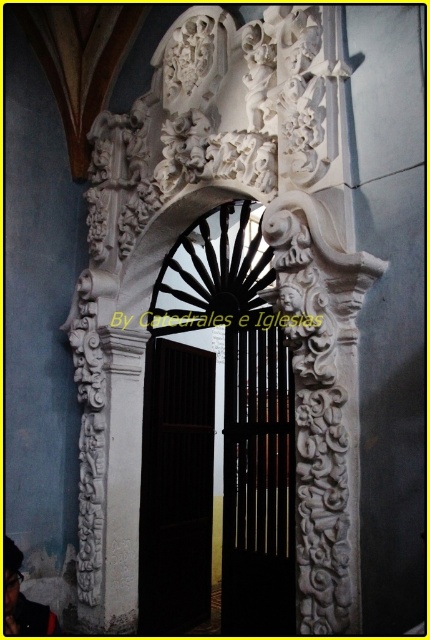
Question: Which point is closer to the camera?

Choices:
 (A) black polished wood door at center
 (B) dark wood door at center
 (C) white carved wood door at center

Answer: (A)

Question: Is white carved wood door at center above dark wood door at center?

Choices:
 (A) no
 (B) yes

Answer: (B)

Question: Does white carved wood door at center have a smaller size compared to black polished wood door at center?

Choices:
 (A) no
 (B) yes

Answer: (A)

Question: Which object is the farthest from the black polished wood door at center?

Choices:
 (A) white carved wood door at center
 (B) dark wood door at center

Answer: (B)

Question: Is white carved wood door at center to the left of dark wood door at center from the viewer's perspective?

Choices:
 (A) yes
 (B) no

Answer: (B)

Question: Estimate the real-world distances between objects in this image. Which object is farther from the black polished wood door at center?

Choices:
 (A) white carved wood door at center
 (B) dark wood door at center

Answer: (B)